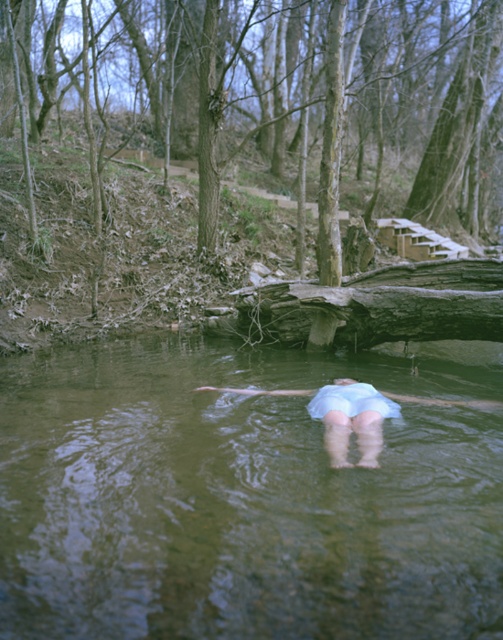
Question: Is green murky water at center wider than light blue fabric at center?

Choices:
 (A) no
 (B) yes

Answer: (B)

Question: Is green murky water at center above light blue fabric at center?

Choices:
 (A) no
 (B) yes

Answer: (A)

Question: Does green murky water at center appear over light blue fabric at center?

Choices:
 (A) yes
 (B) no

Answer: (B)

Question: Which object appears farthest from the camera in this image?

Choices:
 (A) light blue fabric at center
 (B) green murky water at center

Answer: (A)

Question: Among these points, which one is nearest to the camera?

Choices:
 (A) (293, 627)
 (B) (498, 404)

Answer: (A)